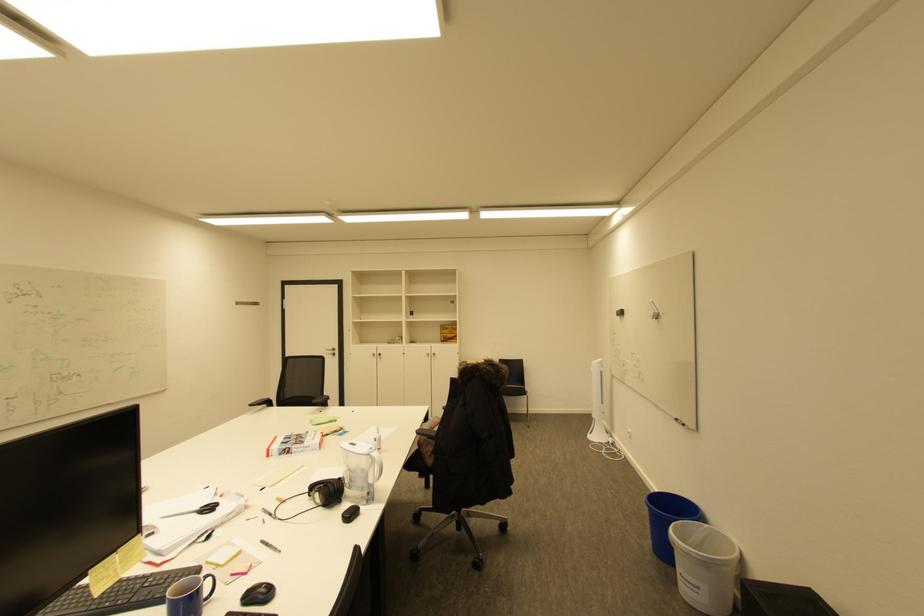
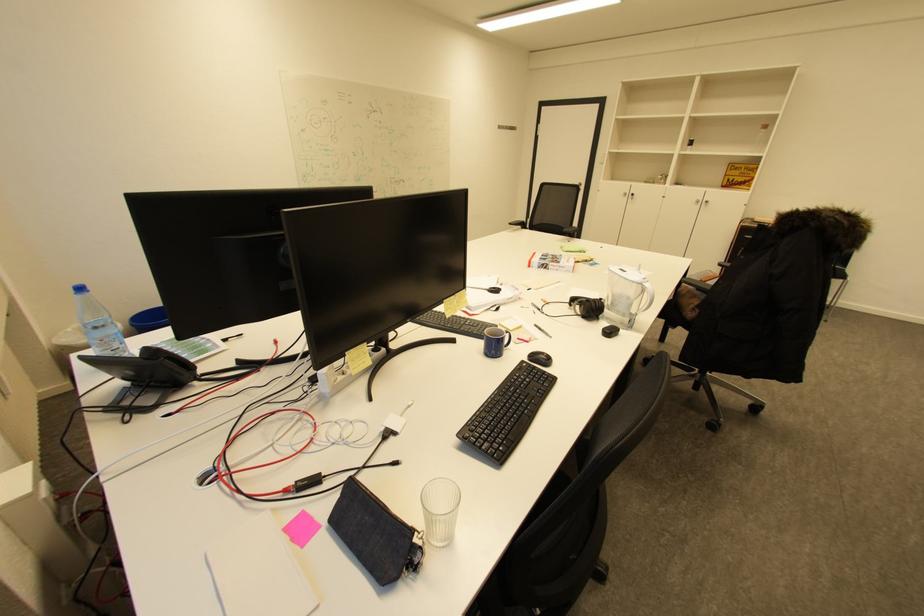
Find the pixel in the second image that matches (319,488) in the first image.

(579, 300)